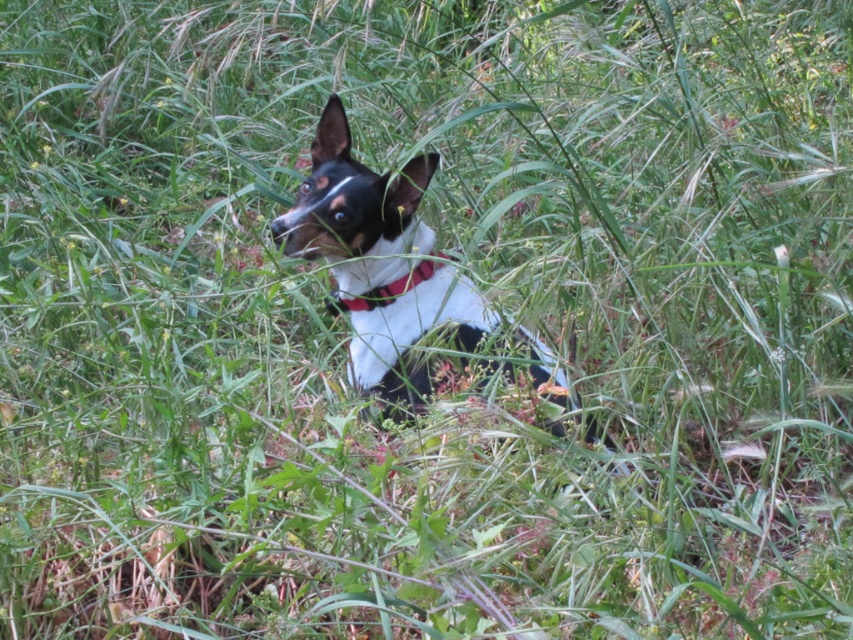
Question: Is black and white fur at center to the right of red fabric collar at center from the viewer's perspective?

Choices:
 (A) yes
 (B) no

Answer: (A)

Question: Which object is closer to the camera taking this photo?

Choices:
 (A) black and white fur at center
 (B) red fabric collar at center

Answer: (A)

Question: Is black and white fur at center further to the viewer compared to red fabric collar at center?

Choices:
 (A) no
 (B) yes

Answer: (A)

Question: Which point is farther to the camera?

Choices:
 (A) red fabric collar at center
 (B) black and white fur at center

Answer: (A)

Question: In this image, where is black and white fur at center located relative to red fabric collar at center?

Choices:
 (A) right
 (B) left

Answer: (A)